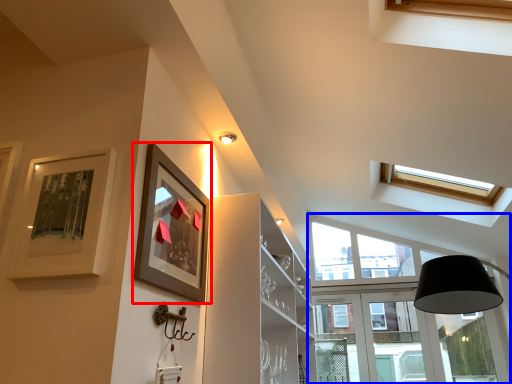
Question: Which point is closer to the camera, picture frame (highlighted by a red box) or window (highlighted by a blue box)?

Choices:
 (A) picture frame
 (B) window

Answer: (A)